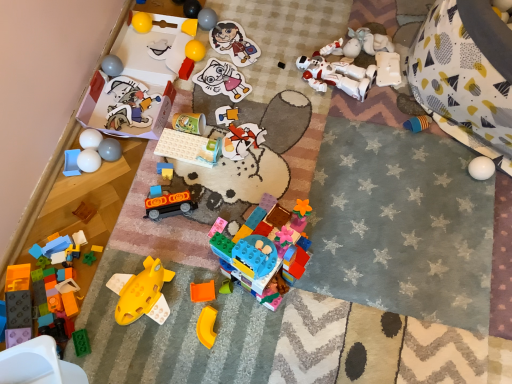
What are the coordinates of `free area in between matte paper sticker at center, the eighteenth toy positioned from the left, and orange matte toy airplane at center, which is the eighth toy from right to left` in the screenshot? It's located at (217, 171).